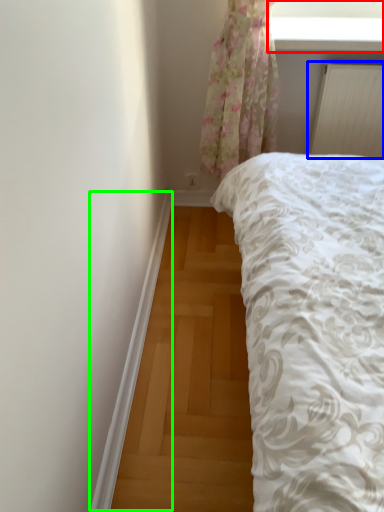
Question: Which object is the closest to the window screen (highlighted by a red box)? Choose among these: radiator (highlighted by a blue box) or trim (highlighted by a green box).

Choices:
 (A) radiator
 (B) trim

Answer: (A)